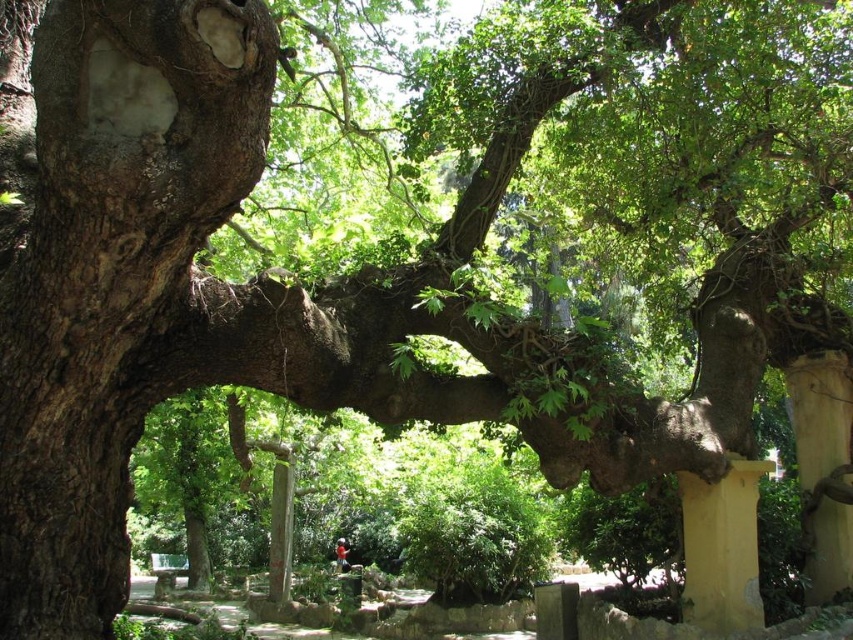
Question: Which point appears closest to the camera in this image?

Choices:
 (A) (821, 461)
 (B) (701, 509)

Answer: (B)

Question: Does yellow painted stone pillar at lower right appear under yellow painted stone pillar at right?

Choices:
 (A) yes
 (B) no

Answer: (A)

Question: Can you confirm if yellow painted stone pillar at lower right is thinner than yellow painted stone pillar at right?

Choices:
 (A) no
 (B) yes

Answer: (A)

Question: Is yellow painted stone pillar at lower right to the right of yellow painted stone pillar at right from the viewer's perspective?

Choices:
 (A) no
 (B) yes

Answer: (A)

Question: Among these objects, which one is farthest from the camera?

Choices:
 (A) yellow painted stone pillar at lower right
 (B) yellow painted stone pillar at right

Answer: (B)